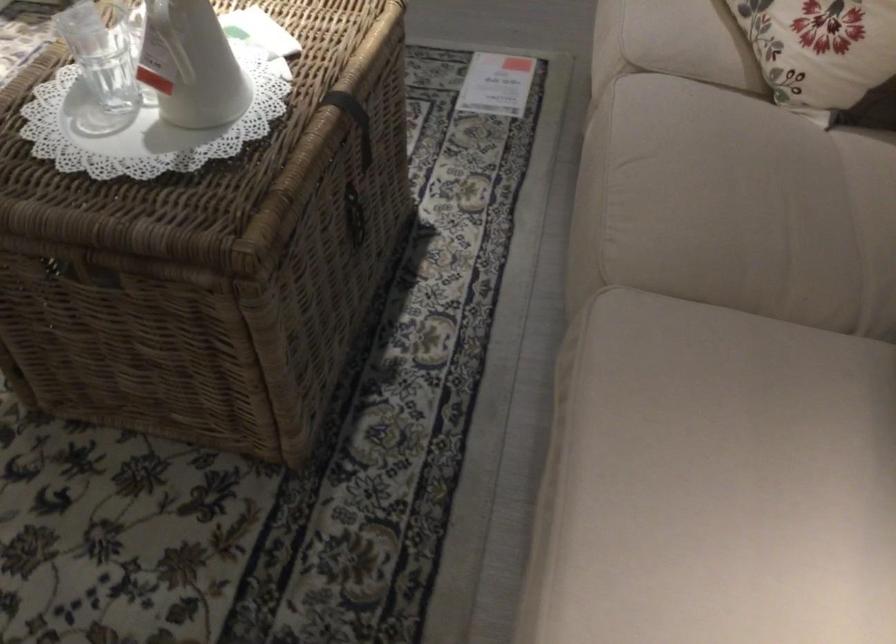
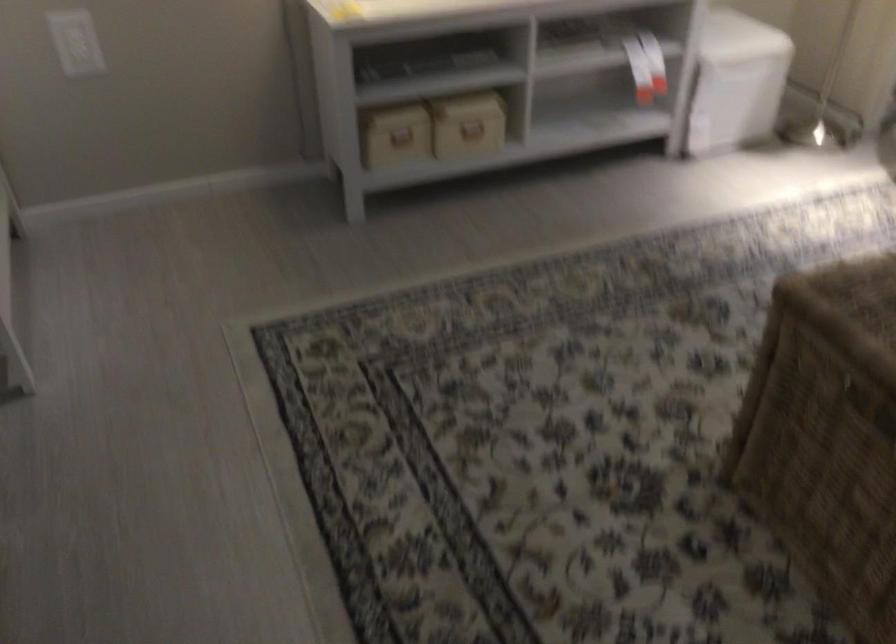
Question: The images are taken continuously from a first-person perspective. In which direction is your viewpoint rotating?

Choices:
 (A) Left
 (B) Right
 (C) Up
 (D) Down

Answer: (A)